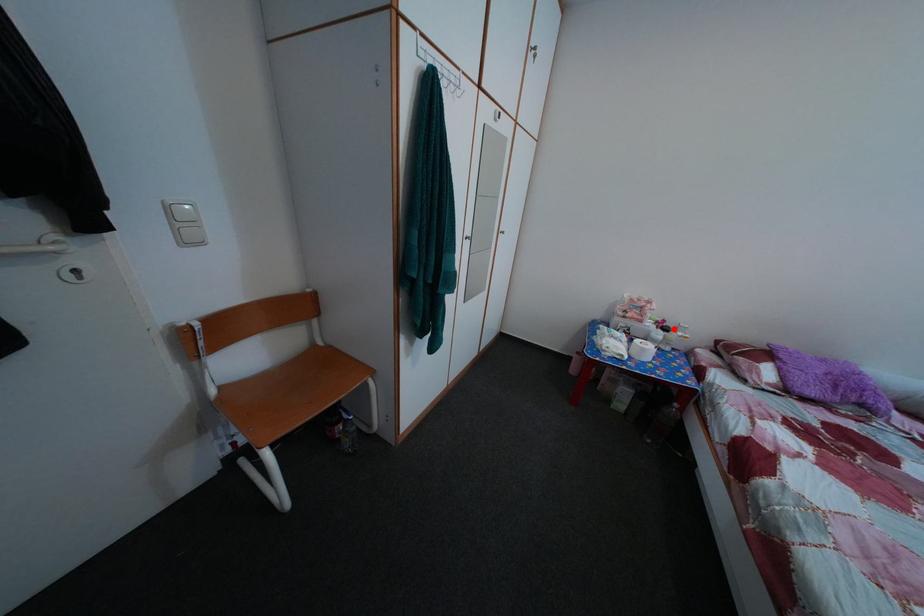
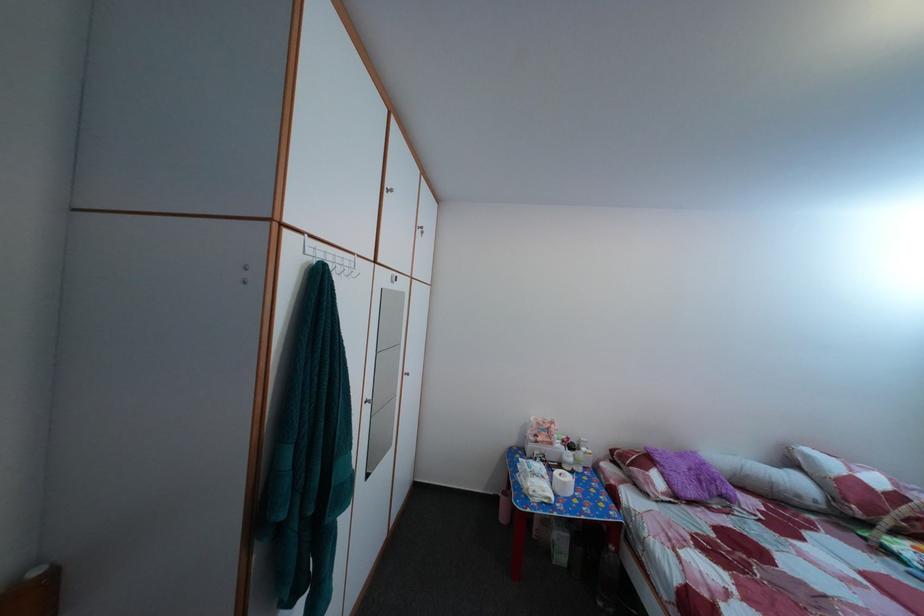
Question: I am providing you with two images of the same scene from different viewpoints. A red point is shown in image1. For the corresponding object point in image2, is it positioned nearer or farther from the camera?

Choices:
 (A) Nearer
 (B) Farther

Answer: (B)